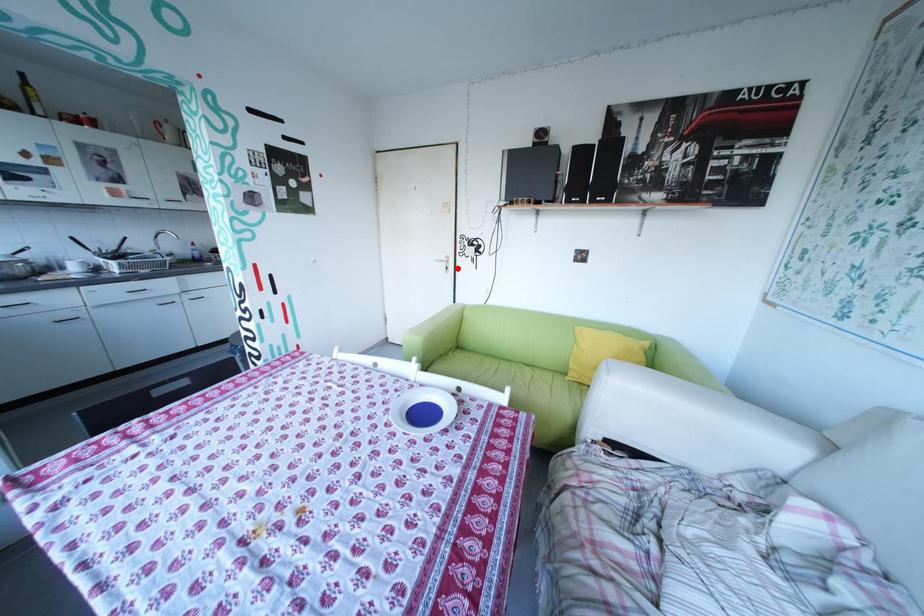
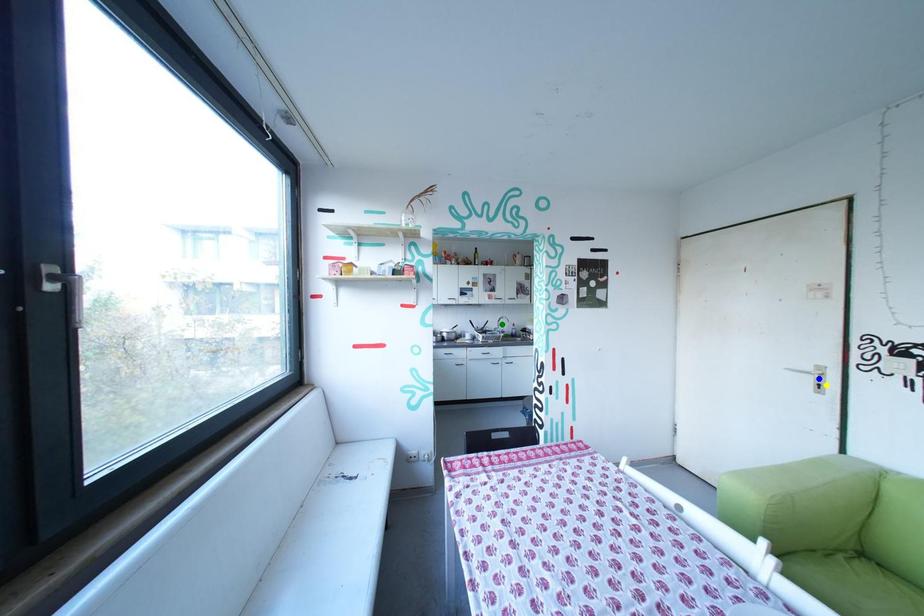
Question: I am providing you with two images of the same scene from different viewpoints. A red point is marked on the first image. You are given multiple points on the second image. Which spot in image 2 lines up with the point in image 1?

Choices:
 (A) green point
 (B) blue point
 (C) yellow point

Answer: (C)